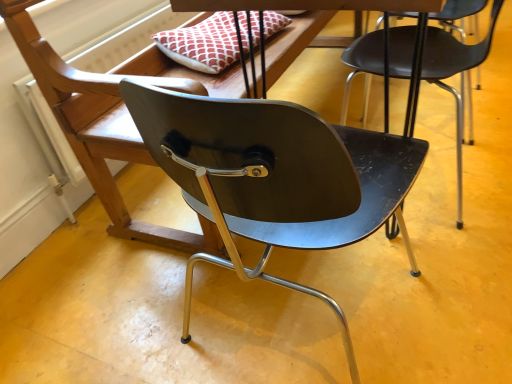
At what (x,y) coordinates should I click in order to perform the action: click on empty space that is to the right of matte black chair at center, the 1th chair viewed from the left. Please return your answer as a coordinate pair (x, y). Looking at the image, I should click on (457, 281).